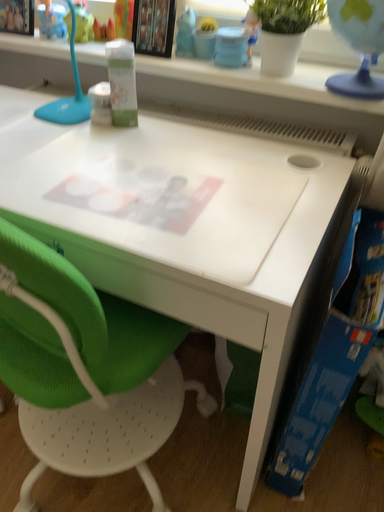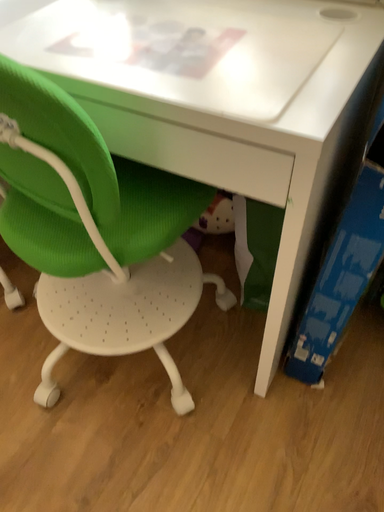
Question: How did the camera likely rotate when shooting the video?

Choices:
 (A) rotated downward
 (B) rotated upward

Answer: (A)